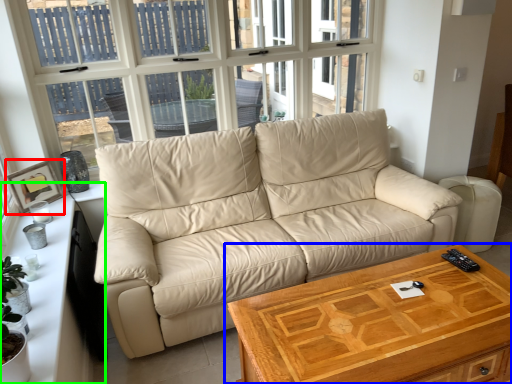
Question: Based on their relative distances, which object is farther from picture frame (highlighted by a red box)? Choose from table (highlighted by a blue box) and dresser (highlighted by a green box).

Choices:
 (A) table
 (B) dresser

Answer: (A)